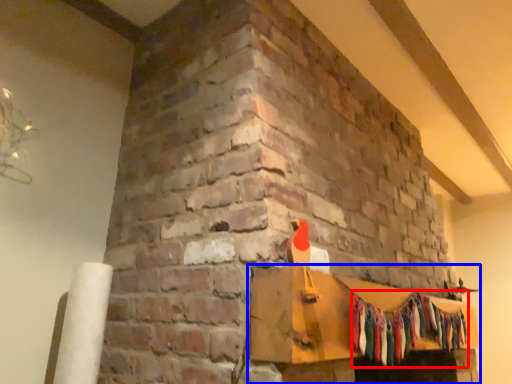
Question: Which object is further to the camera taking this photo, clothing (highlighted by a red box) or furniture (highlighted by a blue box)?

Choices:
 (A) clothing
 (B) furniture

Answer: (A)